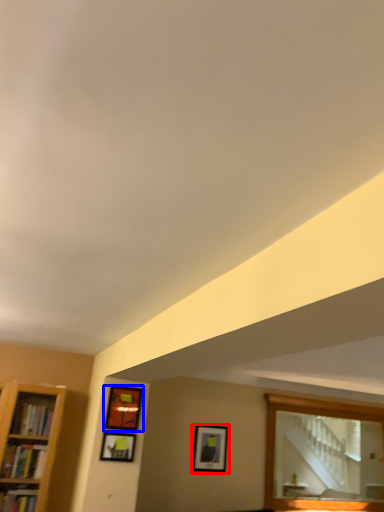
Question: Which object appears closest to the camera in this image, picture frame (highlighted by a red box) or picture frame (highlighted by a blue box)?

Choices:
 (A) picture frame
 (B) picture frame

Answer: (B)